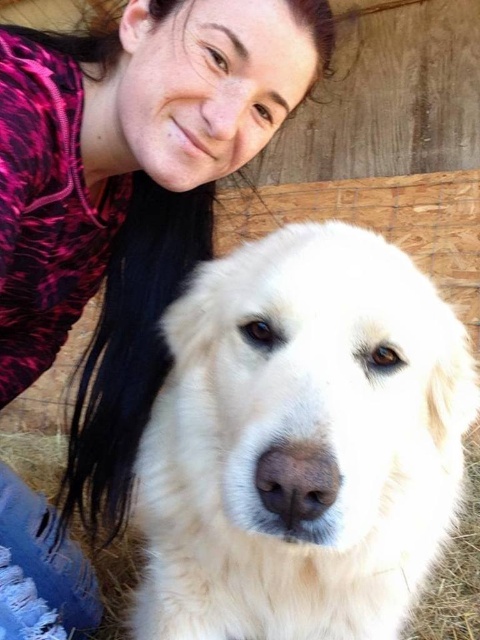
Between point (230, 330) and point (162, 234), which one is positioned in front?

Positioned in front is point (230, 330).

The height and width of the screenshot is (640, 480). Find the location of `white fluffy dog at center`. white fluffy dog at center is located at coordinates (301, 442).